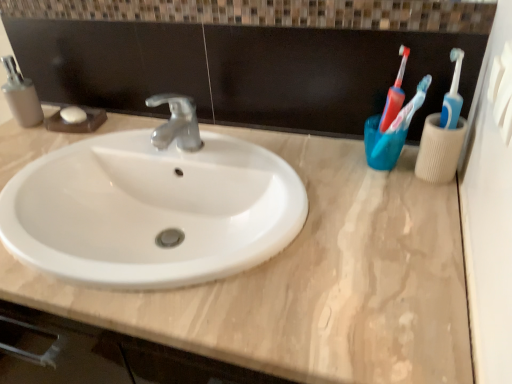
Question: Is translucent blue toothbrush at upper right with matte gray soap dispenser at left?

Choices:
 (A) yes
 (B) no

Answer: (B)

Question: Considering the relative sizes of translucent blue toothbrush at upper right and matte gray soap dispenser at left in the image provided, is translucent blue toothbrush at upper right wider than matte gray soap dispenser at left?

Choices:
 (A) yes
 (B) no

Answer: (B)

Question: Does translucent blue toothbrush at upper right have a lesser width compared to matte gray soap dispenser at left?

Choices:
 (A) no
 (B) yes

Answer: (B)

Question: Could you tell me if translucent blue toothbrush at upper right is facing matte gray soap dispenser at left?

Choices:
 (A) no
 (B) yes

Answer: (A)

Question: From the image's perspective, does translucent blue toothbrush at upper right appear higher than matte gray soap dispenser at left?

Choices:
 (A) yes
 (B) no

Answer: (B)

Question: Is translucent blue toothbrush at upper right taller than matte gray soap dispenser at left?

Choices:
 (A) no
 (B) yes

Answer: (B)

Question: Can you confirm if translucent blue toothbrush at upper right is shorter than beige marble counter top at center?

Choices:
 (A) yes
 (B) no

Answer: (B)

Question: Is translucent blue toothbrush at upper right closer to camera compared to beige marble counter top at center?

Choices:
 (A) no
 (B) yes

Answer: (A)

Question: Does translucent blue toothbrush at upper right lie behind beige marble counter top at center?

Choices:
 (A) yes
 (B) no

Answer: (A)

Question: From a real-world perspective, is translucent blue toothbrush at upper right positioned under beige marble counter top at center based on gravity?

Choices:
 (A) yes
 (B) no

Answer: (B)

Question: Considering the relative sizes of translucent blue toothbrush at upper right and beige marble counter top at center in the image provided, is translucent blue toothbrush at upper right taller than beige marble counter top at center?

Choices:
 (A) yes
 (B) no

Answer: (A)

Question: Considering the relative sizes of translucent blue toothbrush at upper right and beige marble counter top at center in the image provided, is translucent blue toothbrush at upper right smaller than beige marble counter top at center?

Choices:
 (A) yes
 (B) no

Answer: (A)

Question: Does beige marble counter top at center appear on the right side of translucent blue toothbrush at upper right?

Choices:
 (A) no
 (B) yes

Answer: (A)